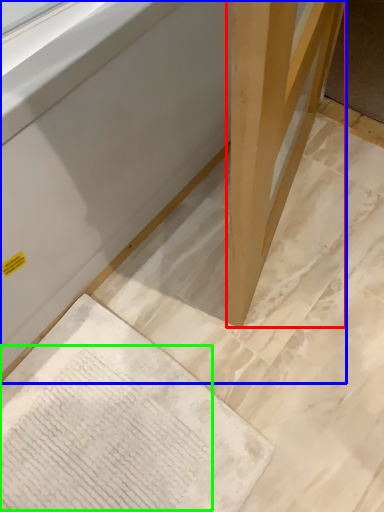
Question: Which is farther away from wood (highlighted by a red box)? furniture (highlighted by a blue box) or writing (highlighted by a green box)?

Choices:
 (A) furniture
 (B) writing

Answer: (B)